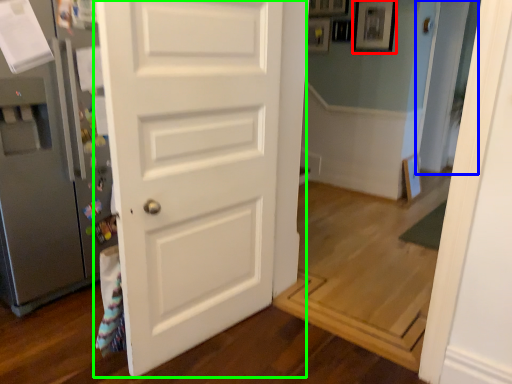
Question: Which object is positioned closest to picture frame (highlighted by a red box)? Select from glass door (highlighted by a blue box) and door (highlighted by a green box).

Choices:
 (A) glass door
 (B) door

Answer: (A)